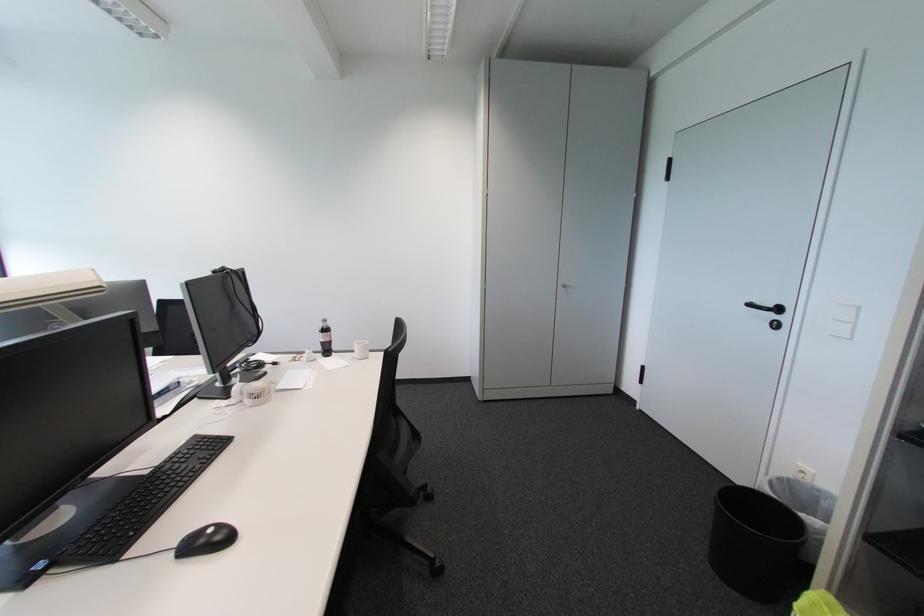
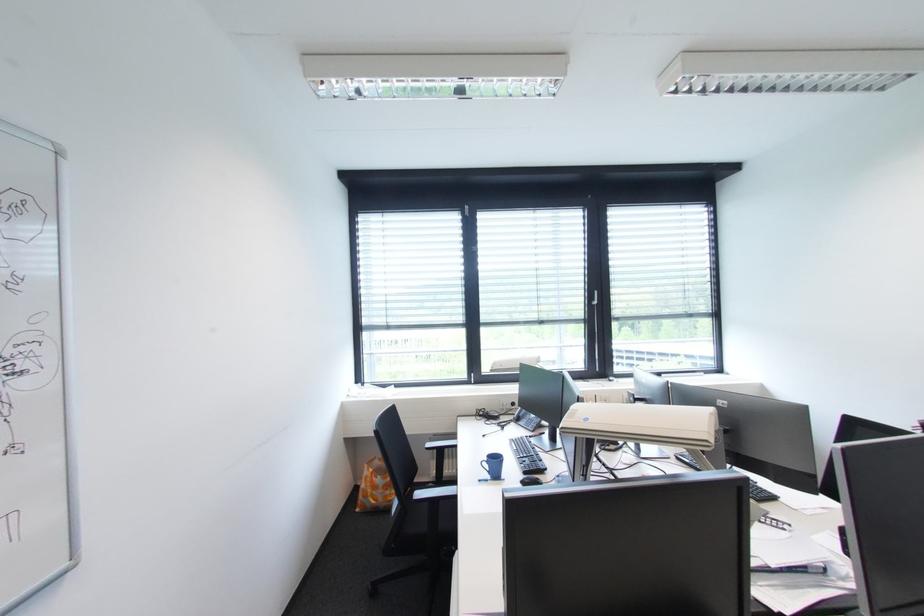
Question: Based on the continuous images, in which direction is the camera rotating? Reply with the corresponding letter.

Choices:
 (A) Left
 (B) Right
 (C) Up
 (D) Down

Answer: (A)